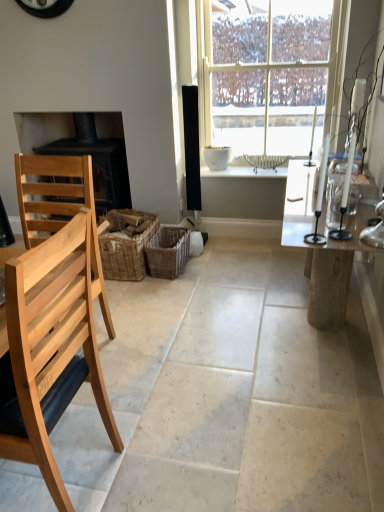
Where is `free space in front of woven brown basket at center, arranged as the 2th crate when viewed from the left`? The height and width of the screenshot is (512, 384). free space in front of woven brown basket at center, arranged as the 2th crate when viewed from the left is located at coordinates pyautogui.click(x=167, y=289).